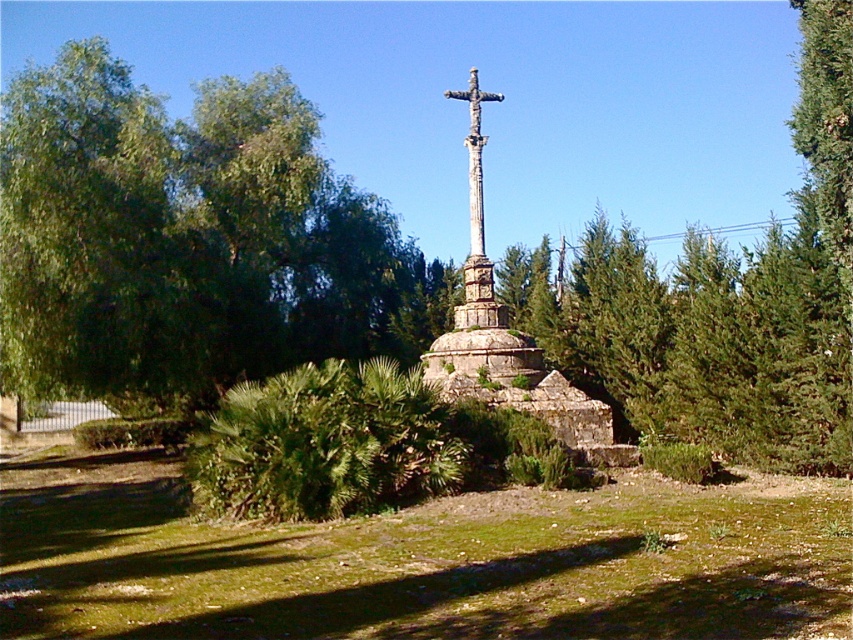
Is green leafy tree at upper left thinner than stone textured cross at center?

Incorrect, green leafy tree at upper left's width is not less than stone textured cross at center's.

Image resolution: width=853 pixels, height=640 pixels. Describe the element at coordinates (187, 241) in the screenshot. I see `green leafy tree at upper left` at that location.

Find the location of a particular element. green leafy tree at upper left is located at coordinates (187, 241).

Does green leafy tree at upper left have a greater width compared to stone cross at center?

Indeed, green leafy tree at upper left has a greater width compared to stone cross at center.

Can you confirm if green leafy tree at upper left is bigger than stone cross at center?

Indeed, green leafy tree at upper left has a larger size compared to stone cross at center.

Image resolution: width=853 pixels, height=640 pixels. Describe the element at coordinates (187, 241) in the screenshot. I see `green leafy tree at upper left` at that location.

At what (x,y) coordinates should I click in order to perform the action: click on green leafy tree at upper left. Please return your answer as a coordinate pair (x, y). Looking at the image, I should click on (187, 241).

Is stone cross at center thinner than stone textured cross at center?

Yes, stone cross at center is thinner than stone textured cross at center.

Which is above, stone cross at center or stone textured cross at center?

stone textured cross at center is higher up.

From the picture: Who is more distant from viewer, (486, 310) or (482, 100)?

The point (482, 100) is behind.

Locate an element on the screen. This screenshot has height=640, width=853. stone cross at center is located at coordinates (480, 296).